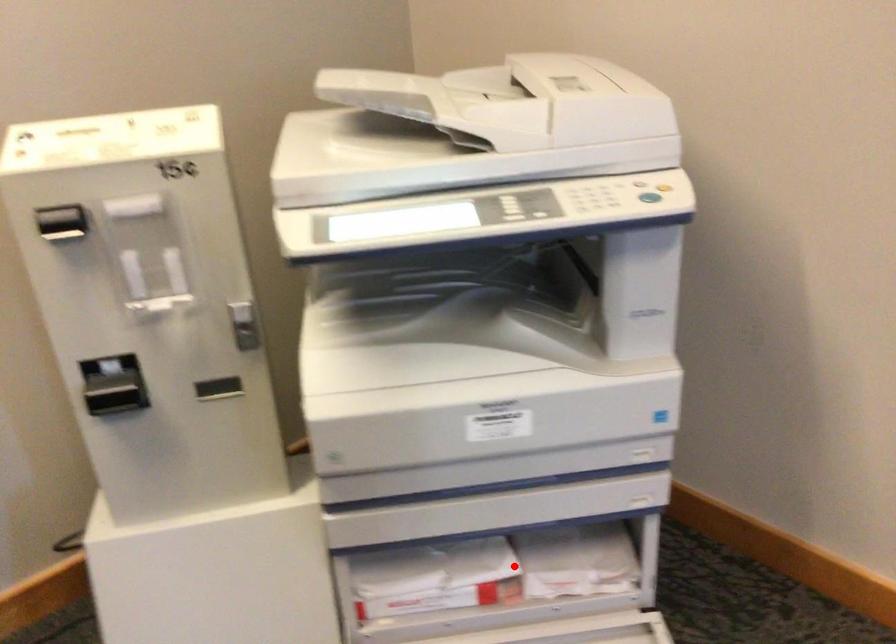
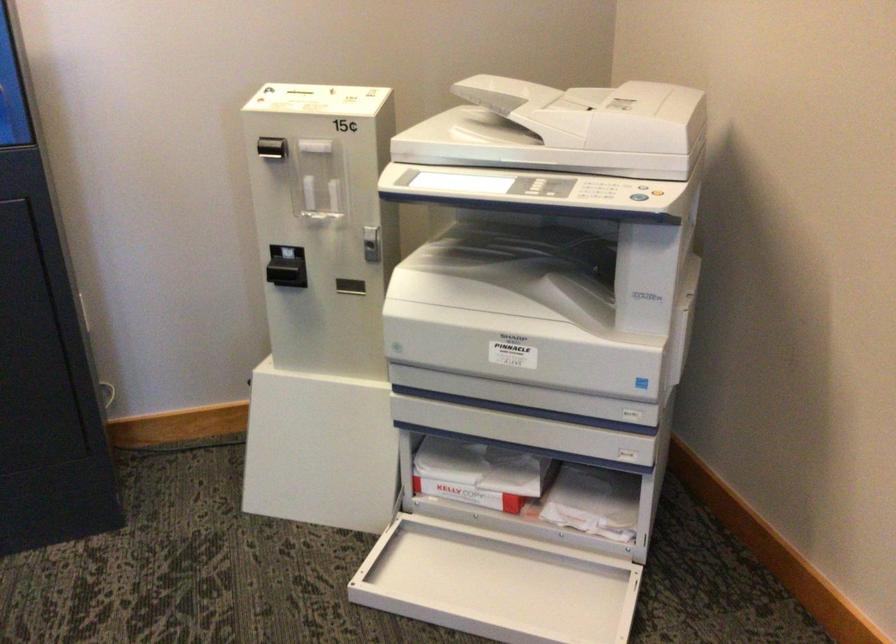
Locate, in the second image, the point that corresponds to the highlighted location in the first image.

(531, 488)